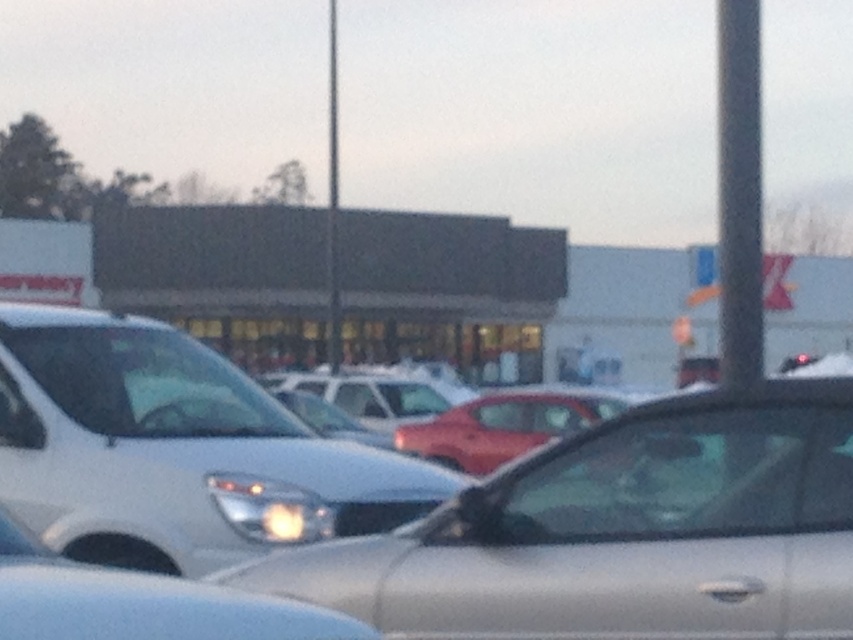
Who is taller, satin silver car at center or white matte van at left?

white matte van at left is taller.

Can you confirm if satin silver car at center is wider than white matte van at left?

No, satin silver car at center is not wider than white matte van at left.

The height and width of the screenshot is (640, 853). Describe the element at coordinates (621, 531) in the screenshot. I see `satin silver car at center` at that location.

This screenshot has width=853, height=640. Identify the location of satin silver car at center. (621, 531).